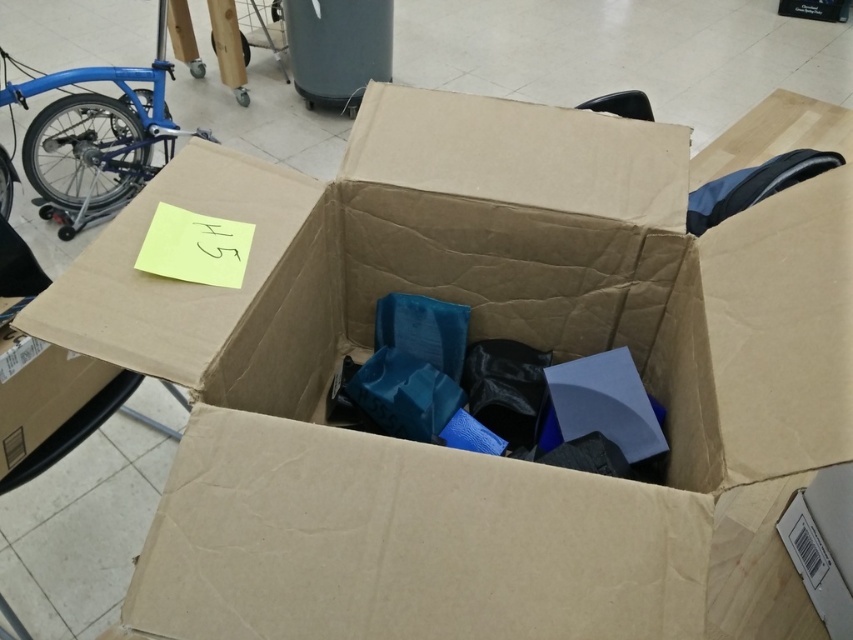
Is blue matte bicycle at left taller than cardboard box at lower left?

Yes.

Who is more forward, (47, 74) or (33, 458)?

Point (33, 458)

Identify the location of blue matte bicycle at left. The height and width of the screenshot is (640, 853). (97, 136).

Where is `blue matte bicycle at left`? blue matte bicycle at left is located at coordinates (97, 136).